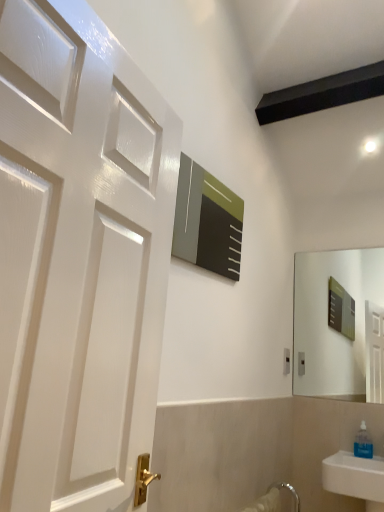
Question: From their relative heights in the image, would you say white plastic electric outlet at upper right is taller or shorter than transparent plastic soap dispenser at lower right?

Choices:
 (A) short
 (B) tall

Answer: (A)

Question: From a real-world perspective, is white plastic electric outlet at upper right above or below transparent plastic soap dispenser at lower right?

Choices:
 (A) below
 (B) above

Answer: (B)

Question: Is point (284, 356) positioned closer to the camera than point (362, 444)?

Choices:
 (A) farther
 (B) closer

Answer: (A)

Question: Is point (357, 431) positioned closer to the camera than point (286, 368)?

Choices:
 (A) farther
 (B) closer

Answer: (B)

Question: In terms of height, does transparent plastic soap dispenser at lower right look taller or shorter compared to white plastic electric outlet at upper right?

Choices:
 (A) short
 (B) tall

Answer: (B)

Question: Relative to white plastic electric outlet at upper right, is transparent plastic soap dispenser at lower right in front or behind?

Choices:
 (A) front
 (B) behind

Answer: (A)

Question: Looking at the image, does transparent plastic soap dispenser at lower right seem bigger or smaller compared to white plastic electric outlet at upper right?

Choices:
 (A) big
 (B) small

Answer: (A)